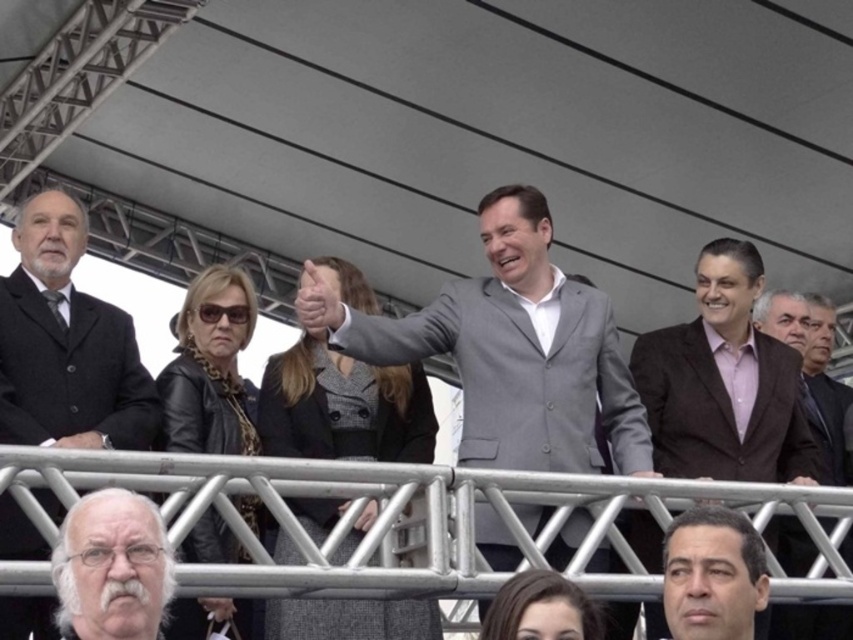
You are attending an event under the industrial canopy and notice two people dressed formally. The first is wearing a gray suit at center, and the second is wearing a brown textured suit at right. Based on their positions, which person is standing closer to the canopy structure?

The gray suit at center is above the brown textured suit at right, so the gray suit at center is closer to the canopy structure.